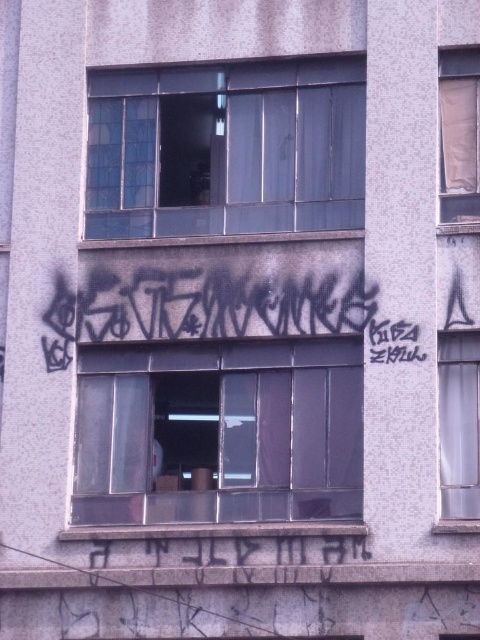
Question: Which object is positioned farthest from the transparent glass window at center?

Choices:
 (A) clear glass window at upper center
 (B) clear glass window at right

Answer: (A)

Question: Which point is closer to the camera?

Choices:
 (A) coord(217,307)
 (B) coord(97,138)
 (C) coord(446,154)
 (D) coord(440,435)

Answer: (D)

Question: Estimate the real-world distances between objects in this image. Which object is farther from the clear glass window at upper center?

Choices:
 (A) black spray paint graffiti at center
 (B) transparent glass window at center
 (C) brown paper at upper right

Answer: (B)

Question: Is black spray paint graffiti at center positioned at the back of brown paper at upper right?

Choices:
 (A) yes
 (B) no

Answer: (A)

Question: Can you confirm if black spray paint graffiti at center is bigger than clear glass window at right?

Choices:
 (A) yes
 (B) no

Answer: (B)

Question: Does transparent glass window at center appear under clear glass window at right?

Choices:
 (A) yes
 (B) no

Answer: (A)